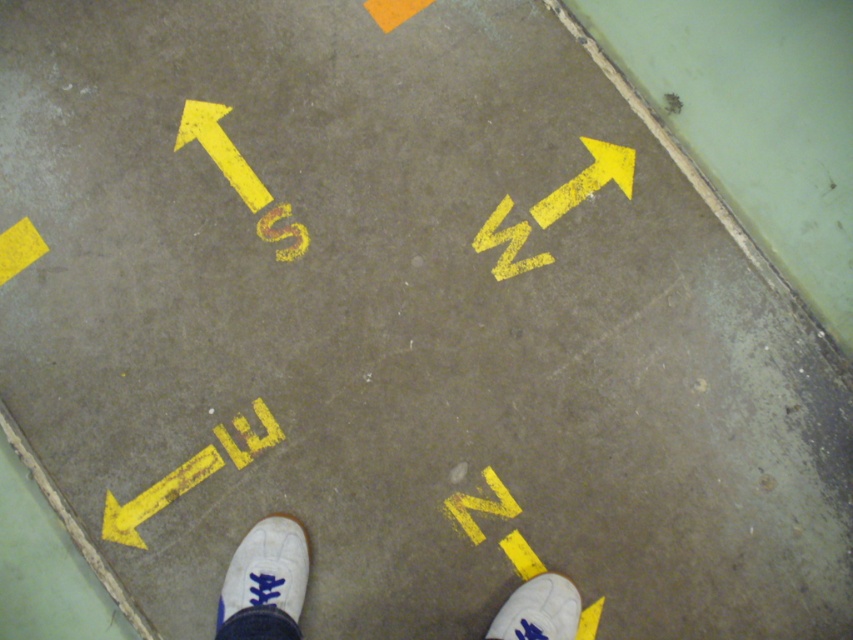
Question: Is white canvas shoe at center to the right of white suede shoe at lower left from the viewer's perspective?

Choices:
 (A) no
 (B) yes

Answer: (A)

Question: Considering the real-world distances, which object is farthest from the white suede shoe at lower right?

Choices:
 (A) white suede shoe at lower left
 (B) white canvas shoe at center

Answer: (B)

Question: Which object is positioned closest to the white suede shoe at lower left?

Choices:
 (A) white canvas shoe at center
 (B) white suede shoe at lower right

Answer: (A)

Question: Can you confirm if white canvas shoe at center is thinner than white suede shoe at lower left?

Choices:
 (A) no
 (B) yes

Answer: (B)

Question: Is white suede shoe at lower left bigger than white suede shoe at lower right?

Choices:
 (A) no
 (B) yes

Answer: (B)

Question: Which of the following is the closest to the observer?

Choices:
 (A) (495, 620)
 (B) (287, 595)

Answer: (B)